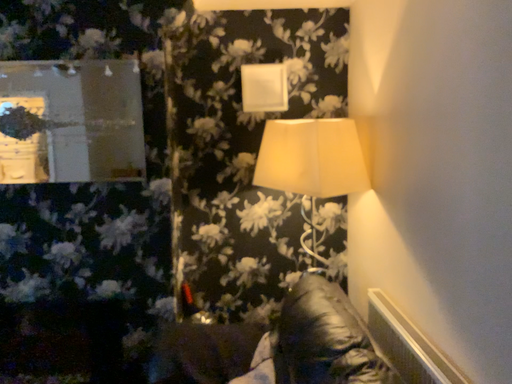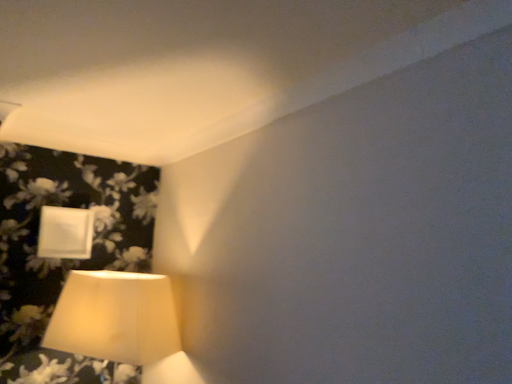
Question: Which way did the camera rotate in the video?

Choices:
 (A) rotated right
 (B) rotated left

Answer: (A)